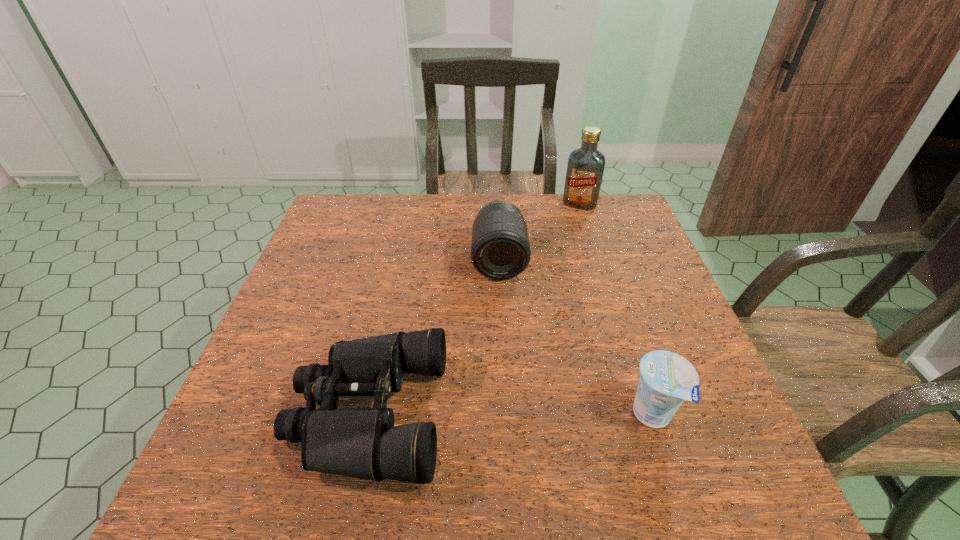
Locate which object ranks second in proximity to the shortest object. Please provide its 2D coordinates. Your answer should be formatted as a tuple, i.e. [(x, y)], where the tuple contains the x and y coordinates of a point satisfying the conditions above.

[(667, 379)]

Identify which object is the third closest to the farthest object. Please provide its 2D coordinates. Your answer should be formatted as a tuple, i.e. [(x, y)], where the tuple contains the x and y coordinates of a point satisfying the conditions above.

[(667, 379)]

Image resolution: width=960 pixels, height=540 pixels. Find the location of `free spot that satisfies the following two spatial constraints: 1. on the back side of the second farthest object; 2. on the left side of the tallest object`. free spot that satisfies the following two spatial constraints: 1. on the back side of the second farthest object; 2. on the left side of the tallest object is located at coordinates (496, 204).

Where is `vacant space that satisfies the following two spatial constraints: 1. on the front side of the second farthest object; 2. on the right side of the yogurt`? vacant space that satisfies the following two spatial constraints: 1. on the front side of the second farthest object; 2. on the right side of the yogurt is located at coordinates (507, 415).